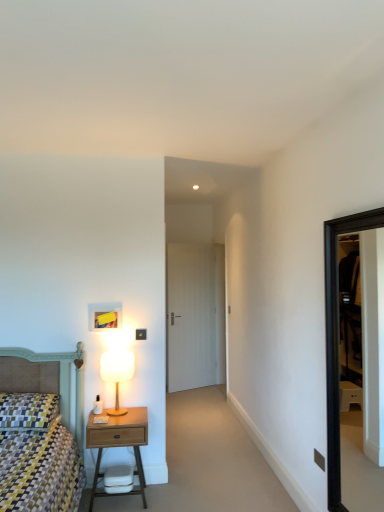
This screenshot has width=384, height=512. I want to click on vacant point to the right of wooden nightstand at lower left, so click(x=179, y=492).